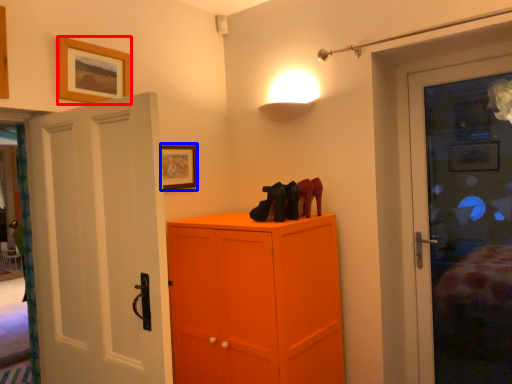
Question: Which point is closer to the camera, picture frame (highlighted by a red box) or picture frame (highlighted by a blue box)?

Choices:
 (A) picture frame
 (B) picture frame

Answer: (A)